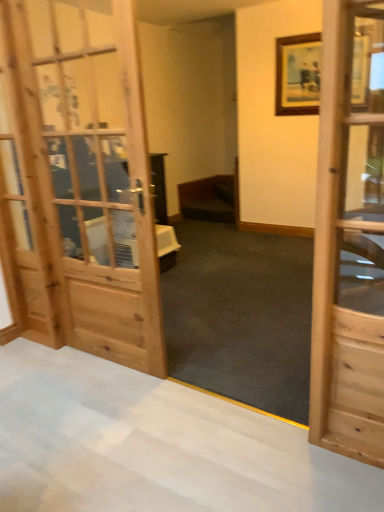
Locate an element on the screen. wooden door at right is located at coordinates pos(349,245).

Describe the element at coordinates (349, 245) in the screenshot. I see `wooden door at right` at that location.

Describe the element at coordinates (209, 199) in the screenshot. The height and width of the screenshot is (512, 384). I see `dark wood bed at center` at that location.

This screenshot has height=512, width=384. Find the location of `dark wood bed at center`. dark wood bed at center is located at coordinates (x=209, y=199).

Locate an element on the screen. The width and height of the screenshot is (384, 512). wooden door at right is located at coordinates (349, 245).

Considering the positions of objects dark wood bed at center and wooden door at right in the image provided, who is more to the left, dark wood bed at center or wooden door at right?

Positioned to the left is dark wood bed at center.

Considering the positions of objects dark wood bed at center and wooden door at right in the image provided, who is in front, dark wood bed at center or wooden door at right?

wooden door at right is in front.

Does point (194, 191) come behind point (343, 139)?

Yes, it is.

From the image's perspective, who appears lower, dark wood bed at center or wooden door at right?

wooden door at right is shown below in the image.

From a real-world perspective, is dark wood bed at center on top of wooden door at right?

No, from a real-world perspective, dark wood bed at center is not above wooden door at right.

Considering the relative sizes of dark wood bed at center and wooden door at right in the image provided, is dark wood bed at center wider than wooden door at right?

Yes.

From their relative heights in the image, would you say dark wood bed at center is taller or shorter than wooden door at right?

dark wood bed at center is shorter than wooden door at right.

In the scene shown: Can you confirm if dark wood bed at center is smaller than wooden door at right?

Incorrect, dark wood bed at center is not smaller in size than wooden door at right.

Is dark wood bed at center not within wooden door at right?

Yes, dark wood bed at center is not within wooden door at right.

Are dark wood bed at center and wooden door at right making contact?

dark wood bed at center is not next to wooden door at right, and they're not touching.

Is dark wood bed at center facing towards wooden door at right?

No, dark wood bed at center is not aimed at wooden door at right.

Can you tell me how much dark wood bed at center and wooden door at right differ in facing direction?

The angle between the facing direction of dark wood bed at center and the facing direction of wooden door at right is 177 degrees.

Image resolution: width=384 pixels, height=512 pixels. What are the coordinates of `door below the dark wood bed at center (from the image's perspective)` in the screenshot? It's located at (349, 245).

Is wooden door at right to the right of dark wood bed at center from the viewer's perspective?

Correct, you'll find wooden door at right to the right of dark wood bed at center.

Does wooden door at right lie in front of dark wood bed at center?

Yes.

Is point (333, 304) farther from camera compared to point (229, 196)?

No, (333, 304) is closer to viewer.

From the picture: From the image's perspective, which one is positioned higher, wooden door at right or dark wood bed at center?

dark wood bed at center appears higher in the image.

From a real-world perspective, is wooden door at right over dark wood bed at center?

Yes, from a real-world perspective, wooden door at right is above dark wood bed at center.

Looking at their sizes, would you say wooden door at right is wider or thinner than dark wood bed at center?

Clearly, wooden door at right has less width compared to dark wood bed at center.

Who is taller, wooden door at right or dark wood bed at center?

wooden door at right.

Which of these two, wooden door at right or dark wood bed at center, is smaller?

With smaller size is wooden door at right.

Based on the photo, would you say dark wood bed at center is part of wooden door at right's contents?

No, dark wood bed at center is not a part of wooden door at right.

Are wooden door at right and dark wood bed at center far apart?

wooden door at right is far away from dark wood bed at center.

Is wooden door at right turned away from dark wood bed at center?

That's not correct — wooden door at right is not looking away from dark wood bed at center.

Measure the distance from wooden door at right to dark wood bed at center.

They are 2.23 meters apart.

I want to click on furniture that appears below the wooden door at right (from a real-world perspective), so click(209, 199).

Locate an element on the screen. Image resolution: width=384 pixels, height=512 pixels. furniture behind the wooden door at right is located at coordinates pyautogui.click(x=209, y=199).

Identify the location of door on the right of dark wood bed at center. (349, 245).